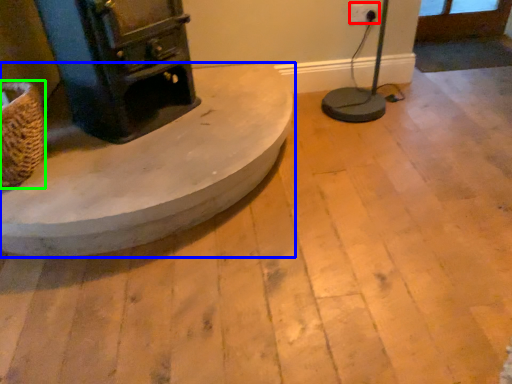
Question: Which is nearer to the electric outlet (highlighted by a red box)? furniture (highlighted by a blue box) or basket (highlighted by a green box).

Choices:
 (A) furniture
 (B) basket

Answer: (A)